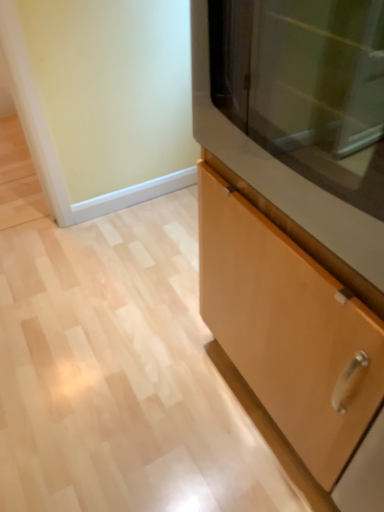
What do you see at coordinates (295, 342) in the screenshot?
I see `light wood cabinet at center` at bounding box center [295, 342].

Find the location of a particular element. This screenshot has width=384, height=512. light wood cabinet at center is located at coordinates (295, 342).

Where is `matte brown cabinet at right`? This screenshot has width=384, height=512. matte brown cabinet at right is located at coordinates (281, 173).

This screenshot has width=384, height=512. Describe the element at coordinates (281, 173) in the screenshot. I see `matte brown cabinet at right` at that location.

The height and width of the screenshot is (512, 384). I want to click on light wood cabinet at center, so click(295, 342).

Considering the positions of objects matte brown cabinet at right and light wood cabinet at center in the image provided, who is more to the right, matte brown cabinet at right or light wood cabinet at center?

light wood cabinet at center.

Which object is closer to the camera taking this photo, matte brown cabinet at right or light wood cabinet at center?

Positioned in front is light wood cabinet at center.

Which is closer, [299,208] or [314,329]?

Point [299,208].

From the image's perspective, is matte brown cabinet at right located above light wood cabinet at center?

Yes, from the image's perspective, matte brown cabinet at right is on top of light wood cabinet at center.

From a real-world perspective, is matte brown cabinet at right over light wood cabinet at center?

Correct, in the physical world, matte brown cabinet at right is higher than light wood cabinet at center.

Considering the sizes of objects matte brown cabinet at right and light wood cabinet at center in the image provided, who is wider, matte brown cabinet at right or light wood cabinet at center?

matte brown cabinet at right.

In the scene shown: Is matte brown cabinet at right taller or shorter than light wood cabinet at center?

Considering their sizes, matte brown cabinet at right has less height than light wood cabinet at center.

Based on the photo, based on their sizes in the image, would you say matte brown cabinet at right is bigger or smaller than light wood cabinet at center?

In the image, matte brown cabinet at right appears to be smaller than light wood cabinet at center.

In the scene shown: Is matte brown cabinet at right located outside light wood cabinet at center?

No, matte brown cabinet at right is inside light wood cabinet at center's boundary.

Would you consider matte brown cabinet at right to be distant from light wood cabinet at center?

No, matte brown cabinet at right is not far from light wood cabinet at center.

Based on the photo, is matte brown cabinet at right aimed at light wood cabinet at center?

Yes, matte brown cabinet at right faces towards light wood cabinet at center.

This screenshot has width=384, height=512. In order to click on microwave on the left of light wood cabinet at center in this screenshot , I will do `click(281, 173)`.

Is light wood cabinet at center to the left of matte brown cabinet at right from the viewer's perspective?

No.

Considering the positions of objects light wood cabinet at center and matte brown cabinet at right in the image provided, who is behind, light wood cabinet at center or matte brown cabinet at right?

Positioned behind is matte brown cabinet at right.

Which point is more distant from viewer, (208,246) or (205,141)?

The point (208,246) is more distant.

From the image's perspective, is light wood cabinet at center positioned above or below matte brown cabinet at right?

light wood cabinet at center is below matte brown cabinet at right.

From a real-world perspective, is light wood cabinet at center physically located above or below matte brown cabinet at right?

Clearly, from a real-world perspective, light wood cabinet at center is below matte brown cabinet at right.

Based on the photo, considering the sizes of objects light wood cabinet at center and matte brown cabinet at right in the image provided, who is wider, light wood cabinet at center or matte brown cabinet at right?

With larger width is matte brown cabinet at right.

In terms of height, does light wood cabinet at center look taller or shorter compared to matte brown cabinet at right?

light wood cabinet at center is taller than matte brown cabinet at right.

Considering the sizes of objects light wood cabinet at center and matte brown cabinet at right in the image provided, who is bigger, light wood cabinet at center or matte brown cabinet at right?

light wood cabinet at center.

Is light wood cabinet at center inside or outside of matte brown cabinet at right?

light wood cabinet at center is outside matte brown cabinet at right.

Is there a large distance between light wood cabinet at center and matte brown cabinet at right?

That's not correct — light wood cabinet at center is a little close to matte brown cabinet at right.

Is light wood cabinet at center looking in the opposite direction of matte brown cabinet at right?

No.

What's the angular difference between light wood cabinet at center and matte brown cabinet at right's facing directions?

180 degrees separate the facing orientations of light wood cabinet at center and matte brown cabinet at right.

Where is `cabinetry directly beneath the matte brown cabinet at right (from a real-world perspective)`? cabinetry directly beneath the matte brown cabinet at right (from a real-world perspective) is located at coordinates (295, 342).

Locate an element on the screen. The image size is (384, 512). microwave that is on the left side of light wood cabinet at center is located at coordinates (281, 173).

Identify the location of cabinetry below the matte brown cabinet at right (from the image's perspective). The width and height of the screenshot is (384, 512). (295, 342).